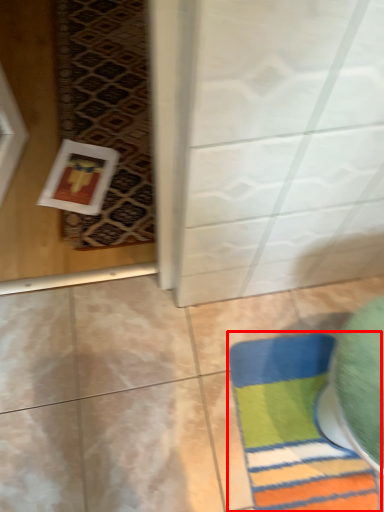
Question: In this image, where is bath mat (annotated by the red box) located relative to mat?

Choices:
 (A) right
 (B) left

Answer: (A)